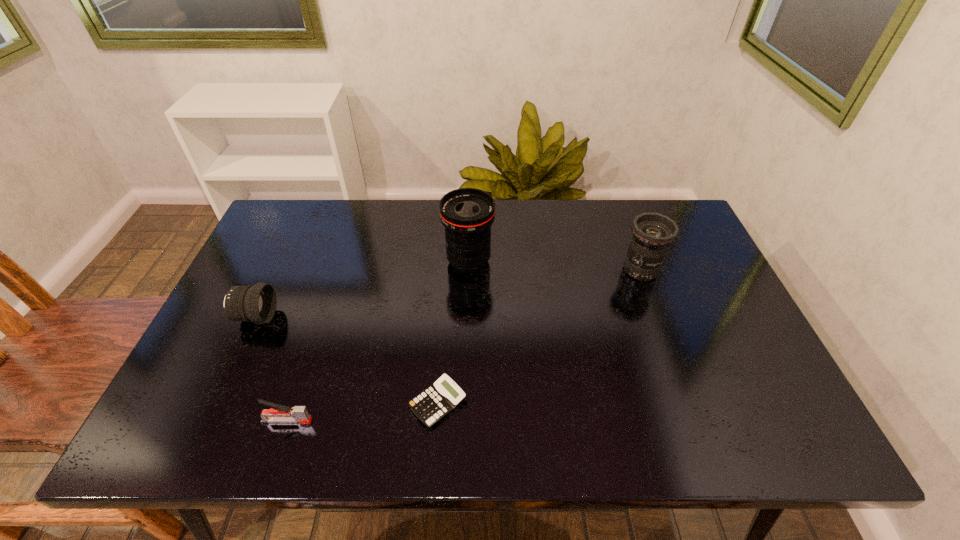
Identify the location of the second telephoto lens from left to right. The width and height of the screenshot is (960, 540). (467, 214).

Locate an element on the screen. Image resolution: width=960 pixels, height=540 pixels. the tallest object is located at coordinates (467, 214).

The height and width of the screenshot is (540, 960). In order to click on the rightmost object in this screenshot , I will do `click(653, 233)`.

The image size is (960, 540). I want to click on the rightmost telephoto lens, so click(x=653, y=233).

Locate an element on the screen. The image size is (960, 540). the third shortest object is located at coordinates [257, 303].

Where is `the shortest telephoto lens`? the shortest telephoto lens is located at coordinates (257, 303).

Find the location of a particular element. the fourth object from right to left is located at coordinates (279, 413).

Locate an element on the screen. Image resolution: width=960 pixels, height=540 pixels. the fourth tallest object is located at coordinates (279, 413).

At what (x,y) coordinates should I click in order to perform the action: click on the shortest object. Please return your answer as a coordinate pair (x, y). Looking at the image, I should click on (438, 400).

Find the location of a particular element. This screenshot has width=960, height=540. vacant region located on the right of the tallest object is located at coordinates (524, 261).